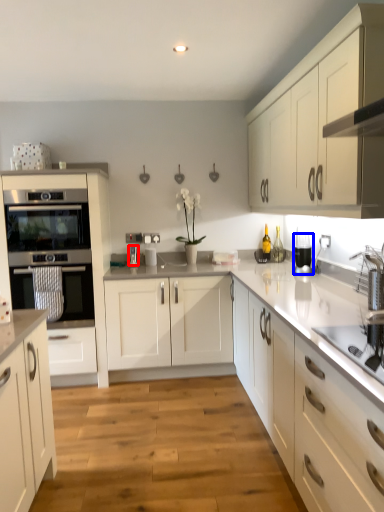
Question: Among these objects, which one is farthest to the camera, appliance (highlighted by a red box) or kitchen appliance (highlighted by a blue box)?

Choices:
 (A) appliance
 (B) kitchen appliance

Answer: (A)